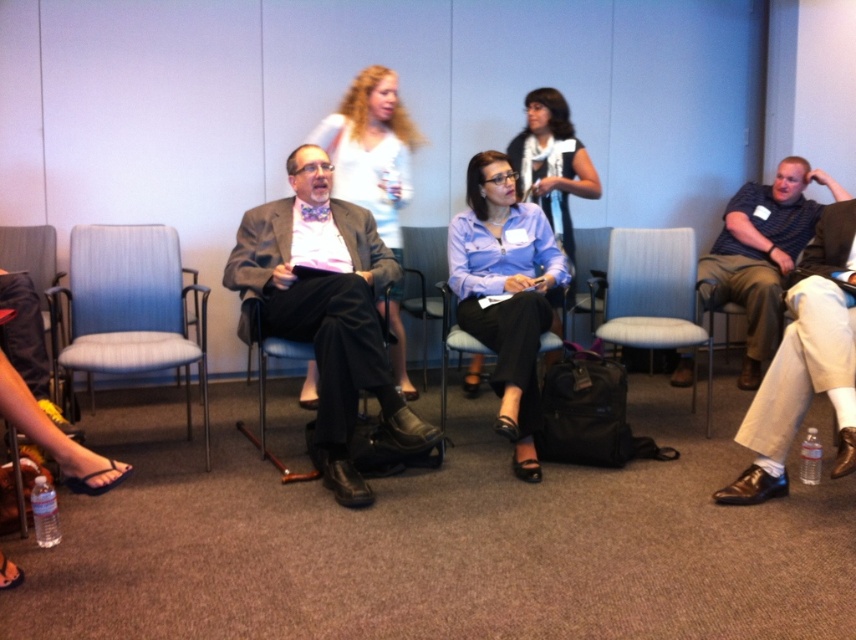
Which of these two, blue fabric chair at left or light blue fabric chair at center, stands shorter?

light blue fabric chair at center is shorter.

Find the location of a particular element. blue fabric chair at left is located at coordinates (128, 308).

Does matte black chair at center have a lesser width compared to black fabric chair at center?

Incorrect, matte black chair at center's width is not less than black fabric chair at center's.

I want to click on matte black chair at center, so click(x=423, y=280).

Is point (129, 337) more distant than point (403, 145)?

No, it is in front of (403, 145).

Who is positioned more to the left, blue fabric chair at left or matte white blouse at center?

blue fabric chair at left

Locate an element on the screen. Image resolution: width=856 pixels, height=640 pixels. blue fabric chair at left is located at coordinates (128, 308).